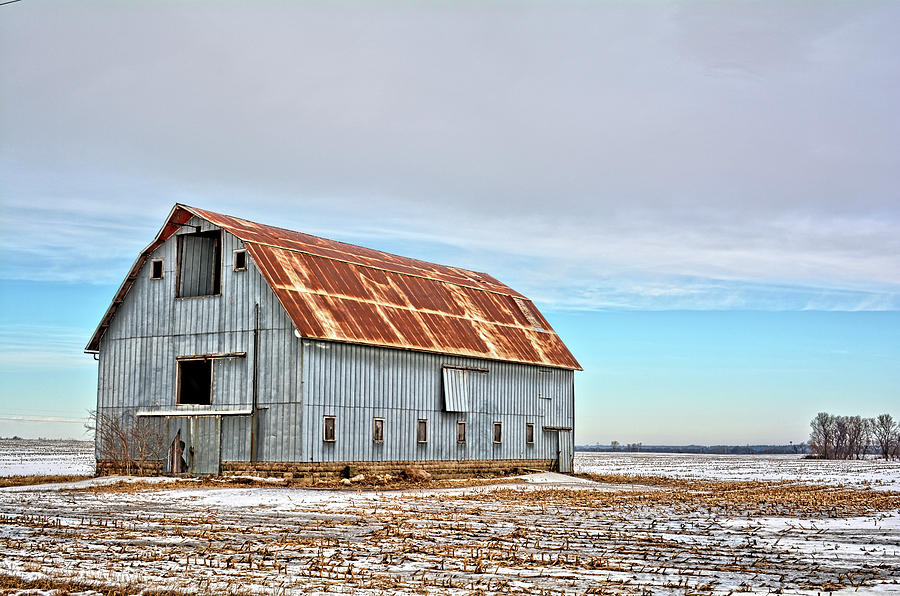
Find the location of a particular element. This screenshot has height=596, width=900. first floor windows is located at coordinates (333, 430), (378, 431), (424, 429), (461, 434), (497, 436), (528, 436).